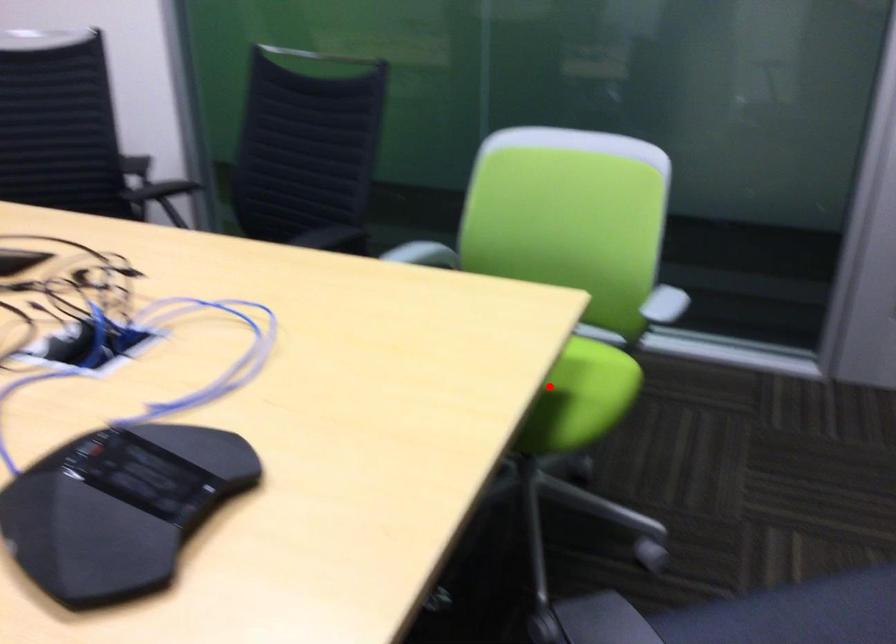
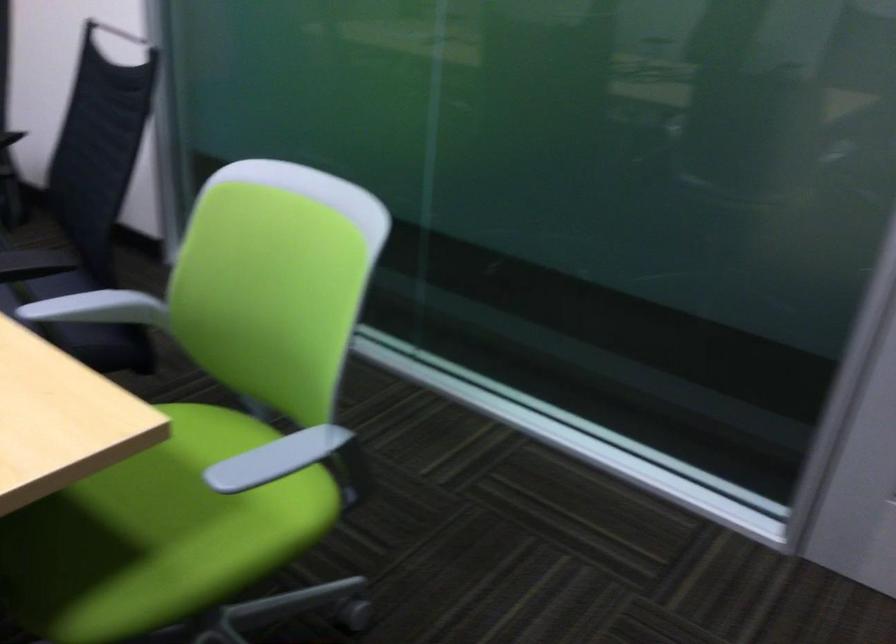
In the second image, find the point that corresponds to the highlighted location in the first image.

(157, 534)